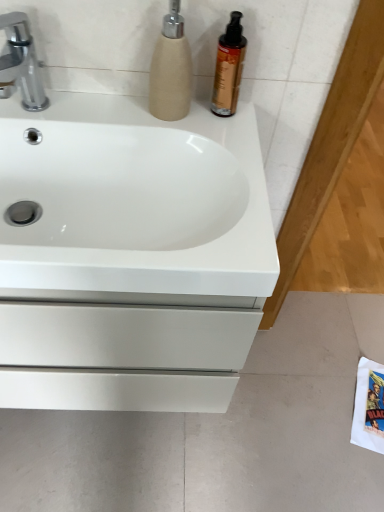
Question: In the image, is white glossy sink at center on the left side or the right side of shiny amber bottle at upper right?

Choices:
 (A) right
 (B) left

Answer: (B)

Question: From a real-world perspective, is white glossy sink at center physically located above or below shiny amber bottle at upper right?

Choices:
 (A) above
 (B) below

Answer: (B)

Question: Based on their relative distances, which object is farther from the white matte drawer at lower left?

Choices:
 (A) shiny amber bottle at upper right
 (B) beige textured soap dispenser at upper center
 (C) white glossy sink at center
 (D) silver metallic faucet at upper left

Answer: (D)

Question: Estimate the real-world distances between objects in this image. Which object is farther from the silver metallic faucet at upper left?

Choices:
 (A) beige textured soap dispenser at upper center
 (B) shiny amber bottle at upper right
 (C) white glossy sink at center
 (D) white matte drawer at lower left

Answer: (D)